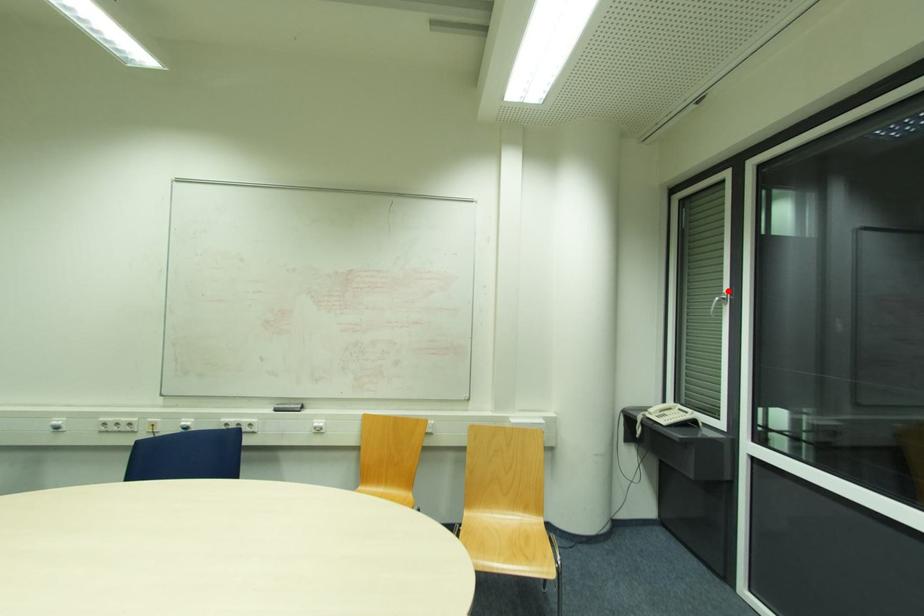
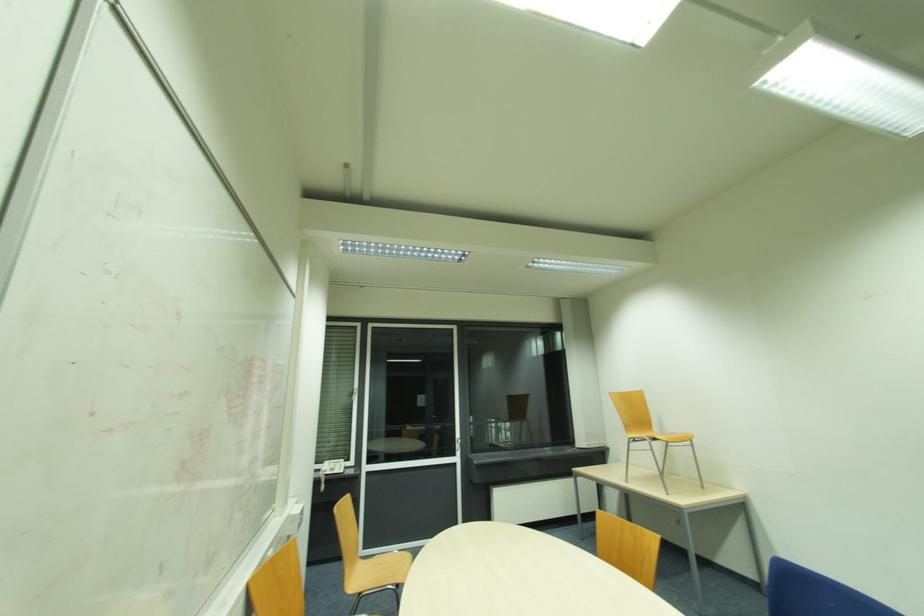
The point at the highlighted location is marked in the first image. Where is the corresponding point in the second image?

(358, 386)